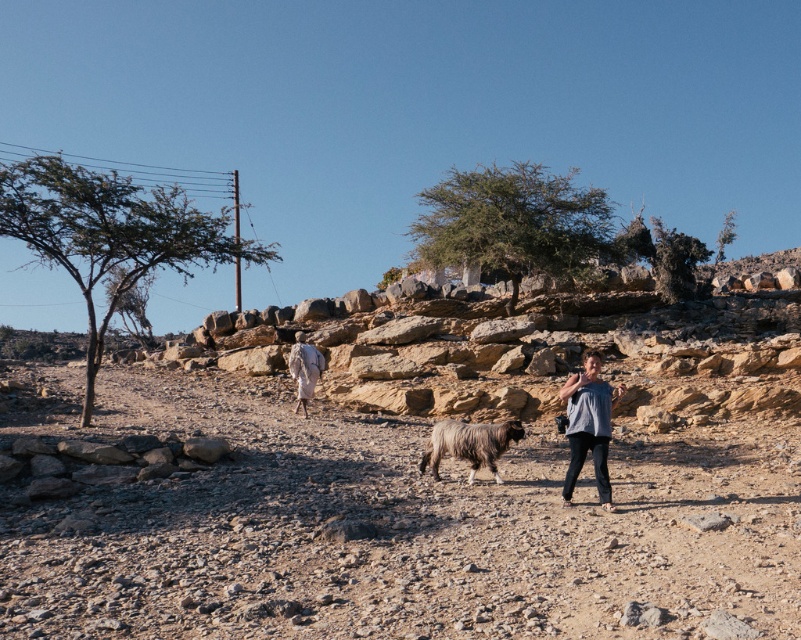
You are a traveler in this arid landscape. You see a dark brown woolly sheep at center and a white cloth at center. Which object is narrower in width?

The dark brown woolly sheep at center is thinner than the white cloth at center, so the dark brown woolly sheep at center is narrower in width.

You are standing at the point labeled point (512, 433) and want to walk to the point labeled point (304, 353). Which direction should you move relative to your current position?

You should move forward because point (512, 433) is closer to the camera than point (304, 353), so to reach the latter, you need to move away from the camera direction.